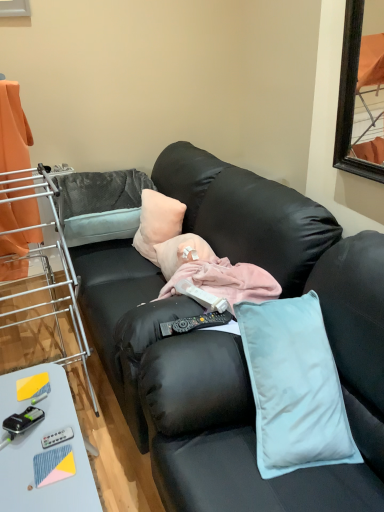
The height and width of the screenshot is (512, 384). In order to click on vacant region to the left of metallic silver remote control at lower left, the second equipment when ordered from left to right in this screenshot , I will do `click(18, 434)`.